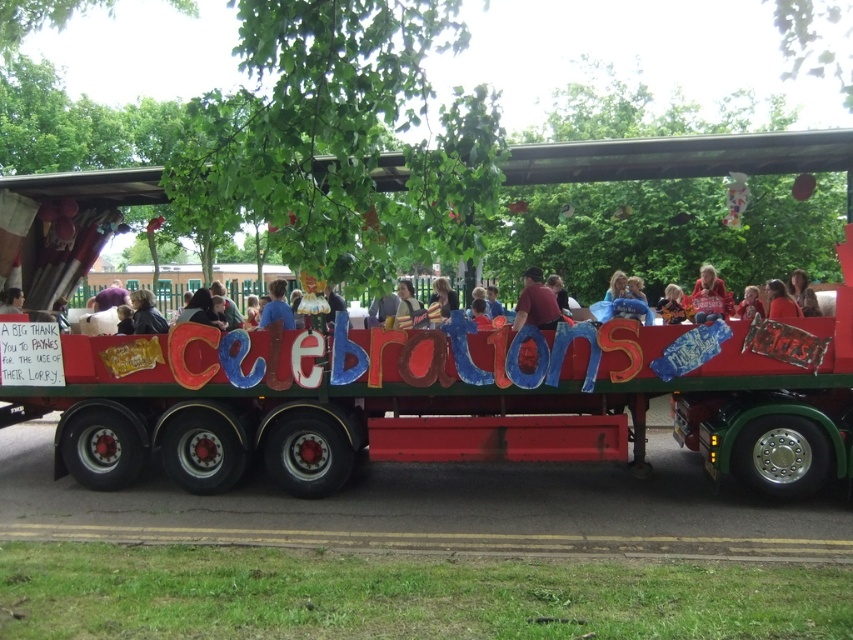
Locate an element on the screen. This screenshot has width=853, height=640. red painted wooden float at center is located at coordinates (387, 397).

Is red painted wooden float at center in front of matte brown jacket at center?

No, red painted wooden float at center is behind matte brown jacket at center.

Is point (47, 184) closer to camera compared to point (419, 307)?

No.

Where is `red painted wooden float at center`? The image size is (853, 640). red painted wooden float at center is located at coordinates (387, 397).

Who is positioned more to the left, red sweater at center or dark brown hair at center?

red sweater at center

How much distance is there between red sweater at center and dark brown hair at center?

red sweater at center is 76.88 centimeters away from dark brown hair at center.

Is point (712, 292) closer to viewer compared to point (780, 298)?

No.

Identify the location of red sweater at center. The width and height of the screenshot is (853, 640). (708, 296).

Between dark brown leather jacket at center and matte brown jacket at center, which one is positioned higher?

matte brown jacket at center is above.

Can you confirm if dark brown leather jacket at center is taller than matte brown jacket at center?

Incorrect, dark brown leather jacket at center's height is not larger of matte brown jacket at center's.

Measure the distance between dark brown leather jacket at center and camera.

dark brown leather jacket at center and camera are 24.88 feet apart.

I want to click on dark brown leather jacket at center, so click(146, 314).